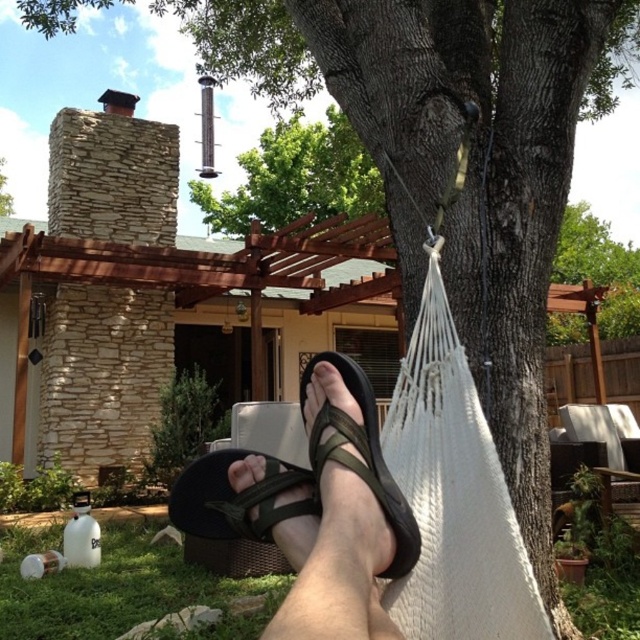
Question: Estimate the real-world distances between objects in this image. Which object is closer to the brown textured wood at upper center?

Choices:
 (A) green fabric sandals at center
 (B) brown wood pole at upper center

Answer: (B)

Question: Which point appears farthest from the camera in this image?

Choices:
 (A) (321, 353)
 (B) (564, 280)
 (C) (1, 172)

Answer: (C)

Question: Which point is farther to the camera?

Choices:
 (A) brown wood pole at upper center
 (B) brown textured wood at upper center
 (C) green fabric sandal at center

Answer: (A)

Question: Does green fabric sandal at lower center appear on the left side of green rough stone chimney at upper left?

Choices:
 (A) no
 (B) yes

Answer: (A)

Question: Is green fabric sandal at lower center positioned at the back of green rough stone chimney at upper left?

Choices:
 (A) yes
 (B) no

Answer: (B)

Question: Does green fabric sandals at center have a smaller size compared to green fabric sandal at lower center?

Choices:
 (A) no
 (B) yes

Answer: (B)